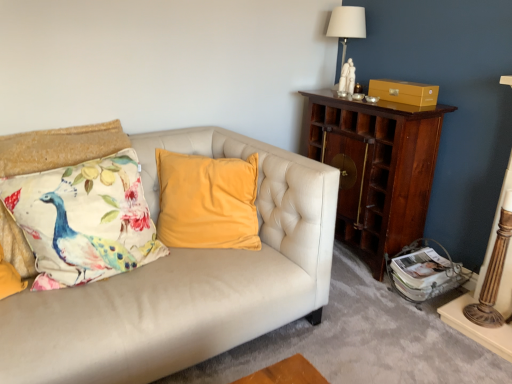
Question: Is matte gold drawer at upper right situated inside printed fabric cushion with peacock design at left or outside?

Choices:
 (A) inside
 (B) outside

Answer: (B)

Question: From the image's perspective, relative to printed fabric cushion with peacock design at left, is matte gold drawer at upper right above or below?

Choices:
 (A) below
 (B) above

Answer: (B)

Question: Estimate the real-world distances between objects in this image. Which object is closer to the printed fabric cushion with peacock design at left?

Choices:
 (A) wooden cabinet at right
 (B) white ceramic table lamp at upper right
 (C) matte gold drawer at upper right

Answer: (A)

Question: Estimate the real-world distances between objects in this image. Which object is closer to the matte gold drawer at upper right?

Choices:
 (A) wooden cabinet at right
 (B) white ceramic table lamp at upper right
 (C) printed fabric cushion with peacock design at left

Answer: (A)